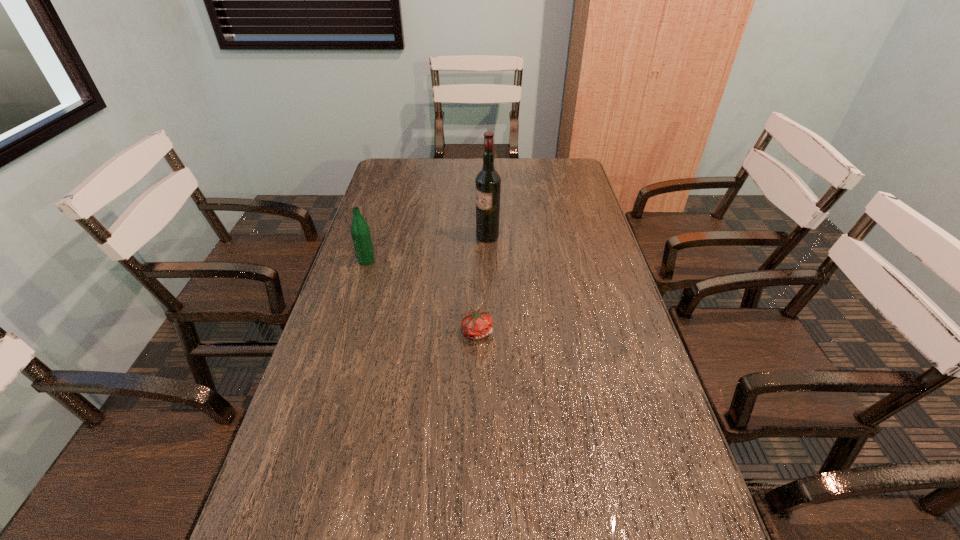
Find the location of a particular element. This screenshot has height=540, width=960. blank region between the leftmost object and the shortest object is located at coordinates (421, 296).

Locate an element on the screen. This screenshot has width=960, height=540. empty space between the nearest object and the second farthest object is located at coordinates (421, 296).

Identify which object is located as the nearest to the nearest object. Please provide its 2D coordinates. Your answer should be formatted as a tuple, i.e. [(x, y)], where the tuple contains the x and y coordinates of a point satisfying the conditions above.

[(488, 181)]

Choose which object is the second nearest neighbor to the farthest object. Please provide its 2D coordinates. Your answer should be formatted as a tuple, i.e. [(x, y)], where the tuple contains the x and y coordinates of a point satisfying the conditions above.

[(476, 325)]

Locate an element on the screen. This screenshot has height=540, width=960. blank area in the image that satisfies the following two spatial constraints: 1. on the front and back of the farthest object; 2. on the front side of the shortest object is located at coordinates (490, 332).

Identify the location of vacant space that satisfies the following two spatial constraints: 1. on the front and back of the tallest object; 2. on the front side of the second tallest object. (488, 260).